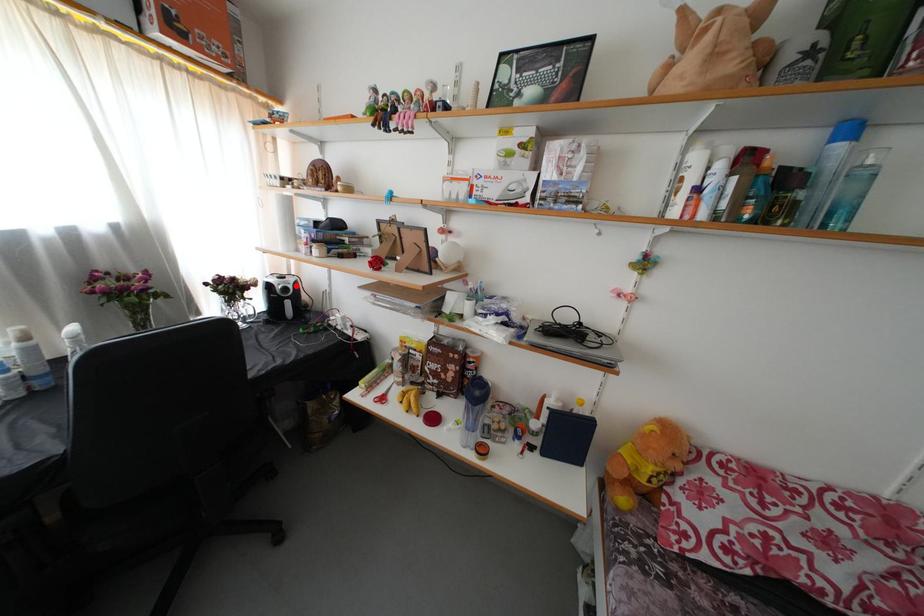
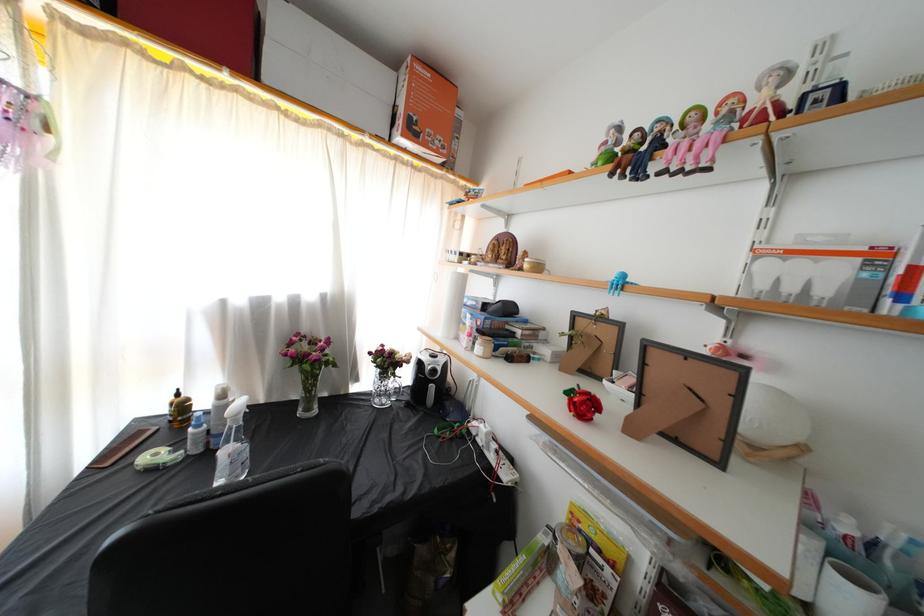
Question: I am providing you with two images of the same scene from different viewpoints. Image1 has a red point marked. In image2, the corresponding 3D location appears at what relative position? Reply with the corresponding letter.

Choices:
 (A) Closer
 (B) Farther

Answer: (B)